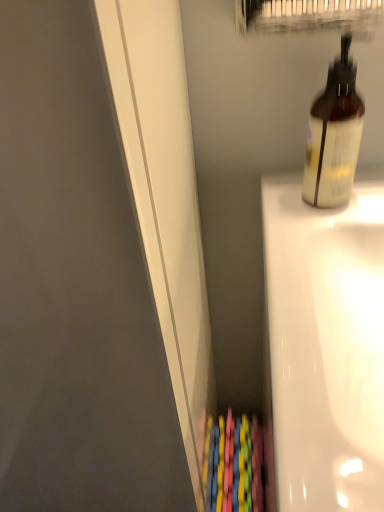
Question: Looking at the image, does white glossy bathtub at right seem bigger or smaller compared to translucent plastic bottle at upper right?

Choices:
 (A) big
 (B) small

Answer: (A)

Question: Is white glossy bathtub at right wider or thinner than translucent plastic bottle at upper right?

Choices:
 (A) wide
 (B) thin

Answer: (A)

Question: Is white glossy bathtub at right spatially inside translucent plastic bottle at upper right, or outside of it?

Choices:
 (A) inside
 (B) outside

Answer: (B)

Question: Do you think translucent plastic bottle at upper right is within white glossy bathtub at right, or outside of it?

Choices:
 (A) inside
 (B) outside

Answer: (B)

Question: Considering the positions of translucent plastic bottle at upper right and white glossy bathtub at right in the image, is translucent plastic bottle at upper right wider or thinner than white glossy bathtub at right?

Choices:
 (A) thin
 (B) wide

Answer: (A)

Question: From the image's perspective, is translucent plastic bottle at upper right positioned above or below white glossy bathtub at right?

Choices:
 (A) above
 (B) below

Answer: (A)

Question: Considering the positions of translucent plastic bottle at upper right and white glossy bathtub at right in the image, is translucent plastic bottle at upper right bigger or smaller than white glossy bathtub at right?

Choices:
 (A) small
 (B) big

Answer: (A)